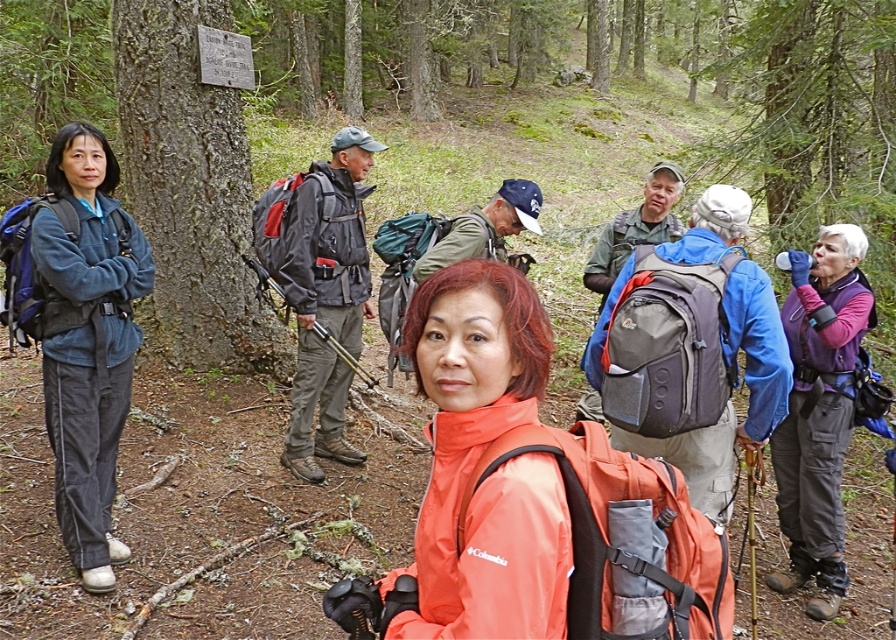
Is smooth bark tree at left closer to camera compared to purple fleece vest at right?

No.

Between point (125, 3) and point (866, 301), which one is positioned behind?

Positioned behind is point (125, 3).

Who is more distant from viewer, (179,118) or (851,268)?

Point (179,118)

Find the location of `smooth bark tree at left`. smooth bark tree at left is located at coordinates (188, 193).

Can you confirm if blue fleece jacket at left is positioned below matte black jacket at center?

Correct, blue fleece jacket at left is located below matte black jacket at center.

Is blue fleece jacket at left shorter than matte black jacket at center?

No.

Is point (80, 538) farther from viewer compared to point (295, 257)?

No, (80, 538) is in front of (295, 257).

Where is `blue fleece jacket at left`? This screenshot has width=896, height=640. blue fleece jacket at left is located at coordinates (87, 339).

Does smooth bark tree at left have a lesser height compared to matte black jacket at center?

No.

Consider the image. Who is higher up, smooth bark tree at left or matte black jacket at center?

smooth bark tree at left is above.

Is point (195, 172) positioned in front of point (259, 253)?

No, it is behind (259, 253).

Locate an element on the screen. smooth bark tree at left is located at coordinates (188, 193).